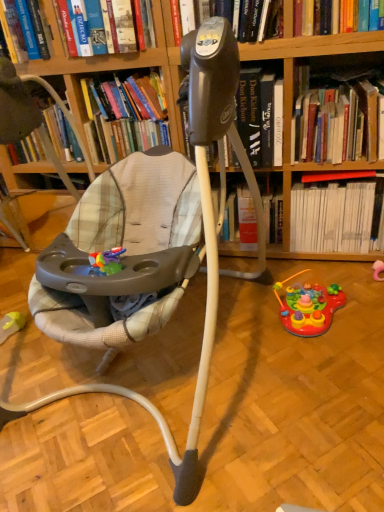
Question: Is there a large distance between hardcover book at upper center, which is counted as the first book, starting from the left, and black plastic tripod at center?

Choices:
 (A) yes
 (B) no

Answer: (B)

Question: Can you confirm if hardcover book at upper center, which appears as the fourth book when viewed from the right, is wider than black plastic tripod at center?

Choices:
 (A) yes
 (B) no

Answer: (B)

Question: Is hardcover book at upper center, which is counted as the first book, starting from the left, oriented away from black plastic tripod at center?

Choices:
 (A) no
 (B) yes

Answer: (A)

Question: Is hardcover book at upper center, which is counted as the first book, starting from the left, at the right side of black plastic tripod at center?

Choices:
 (A) yes
 (B) no

Answer: (B)

Question: From the image's perspective, is hardcover book at upper center, which appears as the fourth book when viewed from the right, on black plastic tripod at center?

Choices:
 (A) yes
 (B) no

Answer: (A)

Question: From a real-world perspective, is rubber yellow toy at lower left, which is the 3th toy from right to left, above or below plush fabric baby carriage at center?

Choices:
 (A) below
 (B) above

Answer: (A)

Question: Does point click(x=13, y=324) appear closer or farther from the camera than point click(x=157, y=289)?

Choices:
 (A) closer
 (B) farther

Answer: (B)

Question: Considering the positions of rubber yellow toy at lower left, which is the 3th toy from right to left, and plush fabric baby carriage at center in the image, is rubber yellow toy at lower left, which is the 3th toy from right to left, wider or thinner than plush fabric baby carriage at center?

Choices:
 (A) thin
 (B) wide

Answer: (A)

Question: Based on their positions, is rubber yellow toy at lower left, the 1th toy viewed from the left, located to the left or right of plush fabric baby carriage at center?

Choices:
 (A) right
 (B) left

Answer: (B)

Question: Is point (329, 309) closer or farther from the camera than point (264, 109)?

Choices:
 (A) farther
 (B) closer

Answer: (A)

Question: From the image's perspective, is rubberized plastic activity center at lower right, the 2th toy positioned from the left, above or below black plastic tripod at center?

Choices:
 (A) above
 (B) below

Answer: (B)

Question: From a real-world perspective, is rubberized plastic activity center at lower right, the 2th toy positioned from the left, physically located above or below black plastic tripod at center?

Choices:
 (A) above
 (B) below

Answer: (B)

Question: In the image, is rubberized plastic activity center at lower right, the 2th toy positioned from the left, positioned in front of or behind black plastic tripod at center?

Choices:
 (A) behind
 (B) front

Answer: (B)

Question: Considering their positions, is hardcover book at upper center, which appears as the fourth book when viewed from the right, located in front of or behind rubber yellow toy at lower left, the 1th toy viewed from the left?

Choices:
 (A) behind
 (B) front

Answer: (B)

Question: Looking at their shapes, would you say hardcover book at upper center, which appears as the fourth book when viewed from the right, is wider or thinner than rubber yellow toy at lower left, the 1th toy viewed from the left?

Choices:
 (A) thin
 (B) wide

Answer: (B)